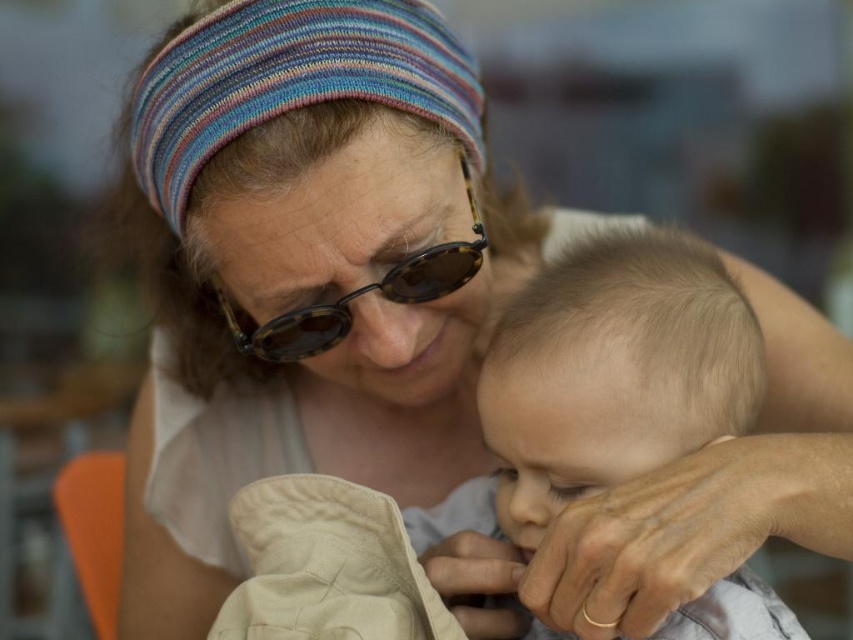
Is smooth beige shirt at center thinner than tortoiseshell sunglasses at center?

No.

Is point (451, 493) farther from viewer compared to point (329, 326)?

Yes, it is.

You are a GUI agent. You are given a task and a screenshot of the screen. Output one action in this format:
    pyautogui.click(x=<x>, y=<y>)
    Task: Click on the smooth beige shirt at center
    The image size is (853, 640).
    Given the screenshot: What is the action you would take?
    pyautogui.click(x=604, y=380)